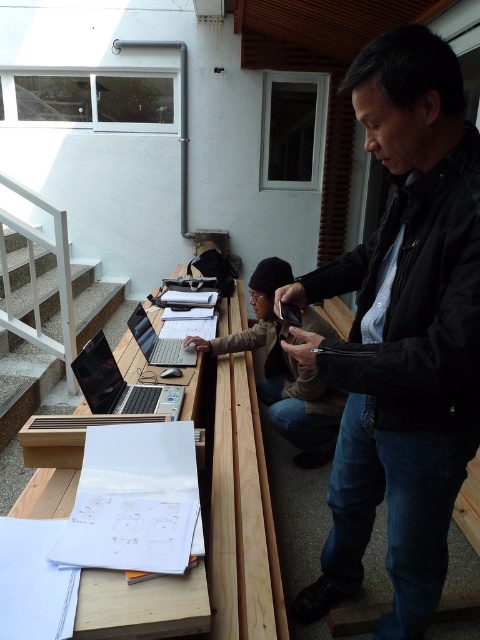
Describe the element at coordinates (23, 381) in the screenshot. I see `wooden stairs at left` at that location.

Does wooden stairs at left have a larger size compared to matte silver laptop at center?

Yes, wooden stairs at left is bigger than matte silver laptop at center.

Does point (9, 339) come closer to viewer compared to point (132, 321)?

No.

This screenshot has width=480, height=640. What are the coordinates of `wooden stairs at left` in the screenshot? It's located at (23, 381).

Who is more distant from viewer, (x=154, y=412) or (x=168, y=346)?

The point (x=168, y=346) is more distant.

What do you see at coordinates (120, 385) in the screenshot?
I see `shiny black laptop at center` at bounding box center [120, 385].

Locate an element on the screen. The height and width of the screenshot is (640, 480). shiny black laptop at center is located at coordinates (120, 385).

Is point (332, 424) positioned behind point (105, 378)?

Yes, it is.

This screenshot has width=480, height=640. Find the location of `wooden desk at center`. wooden desk at center is located at coordinates (284, 372).